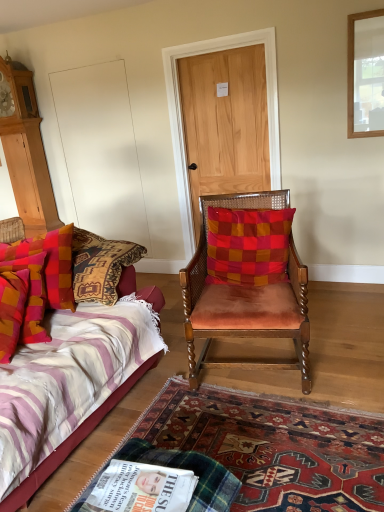
Question: From the image's perspective, does velvet orange chair at center appear higher than carpeted rug at lower center?

Choices:
 (A) yes
 (B) no

Answer: (A)

Question: Is velvet orange chair at center not within carpeted rug at lower center?

Choices:
 (A) no
 (B) yes

Answer: (B)

Question: Is carpeted rug at lower center located within velvet orange chair at center?

Choices:
 (A) no
 (B) yes

Answer: (A)

Question: Is velvet orange chair at center placed right next to carpeted rug at lower center?

Choices:
 (A) yes
 (B) no

Answer: (B)

Question: Can you confirm if velvet orange chair at center is positioned to the right of carpeted rug at lower center?

Choices:
 (A) no
 (B) yes

Answer: (B)

Question: Is carpeted rug at lower center inside the boundaries of white glossy magazine at lower center, or outside?

Choices:
 (A) outside
 (B) inside

Answer: (A)

Question: In the image, is carpeted rug at lower center positioned in front of or behind white glossy magazine at lower center?

Choices:
 (A) behind
 (B) front

Answer: (A)

Question: In terms of width, does carpeted rug at lower center look wider or thinner when compared to white glossy magazine at lower center?

Choices:
 (A) wide
 (B) thin

Answer: (A)

Question: Does point (322, 457) appear closer or farther from the camera than point (152, 501)?

Choices:
 (A) closer
 (B) farther

Answer: (B)

Question: Would you say velvet striped bed at left is to the left or to the right of velvet orange chair at center in the picture?

Choices:
 (A) left
 (B) right

Answer: (A)

Question: Considering their positions, is velvet striped bed at left located in front of or behind velvet orange chair at center?

Choices:
 (A) behind
 (B) front

Answer: (B)

Question: In terms of width, does velvet striped bed at left look wider or thinner when compared to velvet orange chair at center?

Choices:
 (A) wide
 (B) thin

Answer: (A)

Question: From the image's perspective, is velvet striped bed at left above or below velvet orange chair at center?

Choices:
 (A) above
 (B) below

Answer: (B)

Question: Considering the positions of light brown wood door at center and red checkered cushion at center, which is the second pillow from left to right, in the image, is light brown wood door at center bigger or smaller than red checkered cushion at center, which is the second pillow from left to right,?

Choices:
 (A) big
 (B) small

Answer: (A)

Question: In terms of width, does light brown wood door at center look wider or thinner when compared to red checkered cushion at center, which is the second pillow from left to right?

Choices:
 (A) wide
 (B) thin

Answer: (B)